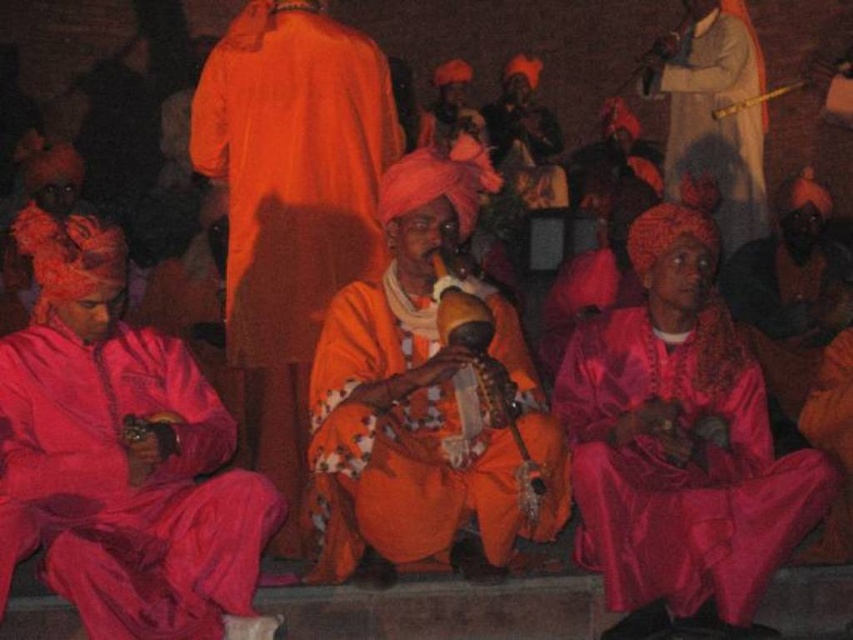
Which is above, matte pink robe at left or orange satin robe at center?

matte pink robe at left is higher up.

Is point (120, 387) closer to viewer compared to point (469, 435)?

Yes, it is.

Is point (7, 490) positioned behind point (519, 330)?

No, (7, 490) is in front of (519, 330).

Find the location of `matte pink robe at left`. matte pink robe at left is located at coordinates (120, 456).

Between orange satin robe at center and silky beige robe at upper right, which one has less height?

silky beige robe at upper right is shorter.

Who is lower down, orange satin robe at center or silky beige robe at upper right?

orange satin robe at center is below.

Describe the element at coordinates (422, 436) in the screenshot. Image resolution: width=853 pixels, height=640 pixels. I see `orange satin robe at center` at that location.

Find the location of `orange satin robe at center`. orange satin robe at center is located at coordinates (422, 436).

In the scene shown: Can you confirm if matte pink robe at left is smaller than shiny silk robe at lower right?

Yes.

Between matte pink robe at left and shiny silk robe at lower right, which one appears on the left side from the viewer's perspective?

From the viewer's perspective, matte pink robe at left appears more on the left side.

Where is `matte pink robe at left`? This screenshot has width=853, height=640. matte pink robe at left is located at coordinates (120, 456).